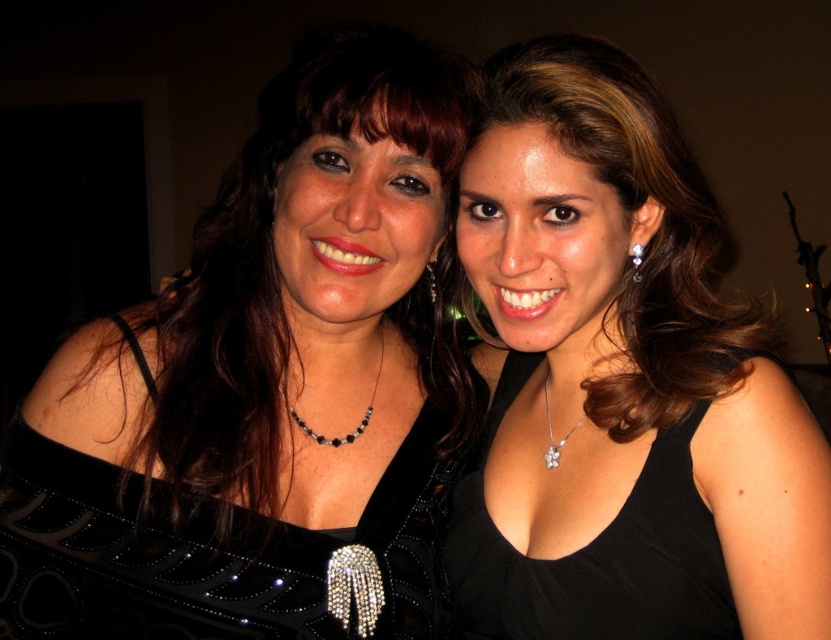
Describe the element at coordinates (622, 381) in the screenshot. This screenshot has height=640, width=831. I see `black satin dress at center` at that location.

Is black satin dress at center to the left of shiny black dress at center from the viewer's perspective?

In fact, black satin dress at center is to the right of shiny black dress at center.

Is point (697, 195) positioned behind point (204, 372)?

Yes, it is behind point (204, 372).

The image size is (831, 640). Find the location of `black satin dress at center`. black satin dress at center is located at coordinates coord(622,381).

Based on the photo, is black beaded necklace at center positioned in front of silver metallic earring at center?

No, it is behind silver metallic earring at center.

Does black beaded necklace at center have a lesser height compared to silver metallic earring at center?

In fact, black beaded necklace at center may be taller than silver metallic earring at center.

Is point (379, 368) positioned after point (633, 252)?

Yes.

Locate an element on the screen. The height and width of the screenshot is (640, 831). black beaded necklace at center is located at coordinates (360, 420).

Does black satin dress at right appear over silver metallic necklace at center?

No.

Is point (505, 560) in front of point (553, 442)?

Yes, point (505, 560) is closer to viewer.

Between point (715, 541) and point (578, 426), which one is positioned in front?

Point (715, 541)

The image size is (831, 640). Find the location of `black satin dress at right`. black satin dress at right is located at coordinates (593, 554).